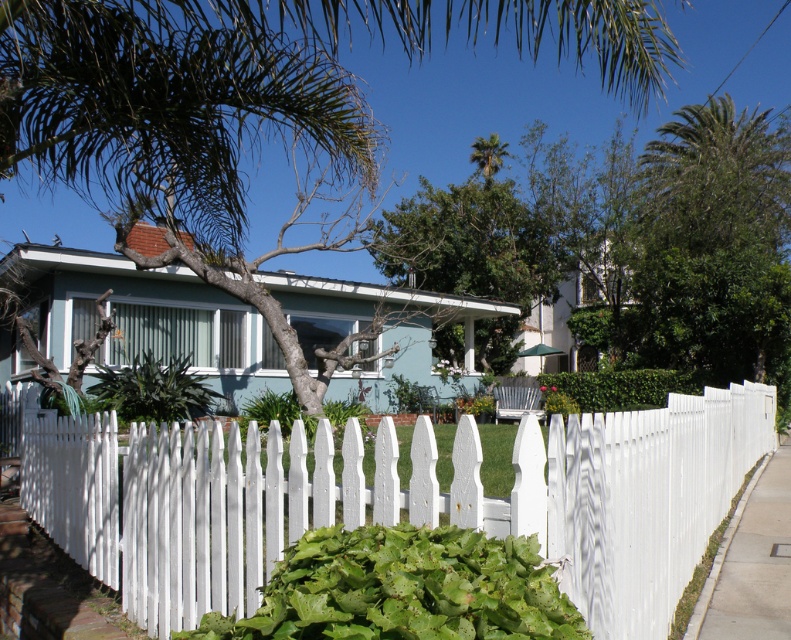
Which is behind, point (644, 476) or point (308, 125)?

The point (308, 125) is more distant.

Based on the photo, is white picket fence at center closer to the viewer compared to green leafy tree at center?

That is True.

Looking at this image, measure the distance between white picket fence at center and camera.

white picket fence at center and camera are 2.74 meters apart.

This screenshot has height=640, width=791. Identify the location of white picket fence at center. (392, 499).

Can you confirm if smooth concrete sidewalk at lower right is smaller than green leafy palm tree at upper center?

Correct, smooth concrete sidewalk at lower right occupies less space than green leafy palm tree at upper center.

Can you confirm if smooth concrete sidewalk at lower right is thinner than green leafy palm tree at upper center?

Correct, smooth concrete sidewalk at lower right's width is less than green leafy palm tree at upper center's.

Between point (733, 579) and point (494, 161), which one is positioned in front?

Point (733, 579) is more forward.

Locate an element on the screen. smooth concrete sidewalk at lower right is located at coordinates (751, 563).

Who is higher up, white picket fence at center or green leafy palm tree at upper center?

green leafy palm tree at upper center

Does white picket fence at center have a greater width compared to green leafy palm tree at upper center?

Yes.

Is point (125, 470) in front of point (489, 164)?

Yes, point (125, 470) is closer to viewer.

At what (x,y) coordinates should I click in order to perform the action: click on white picket fence at center. Please return your answer as a coordinate pair (x, y). This screenshot has width=791, height=640. Looking at the image, I should click on (392, 499).